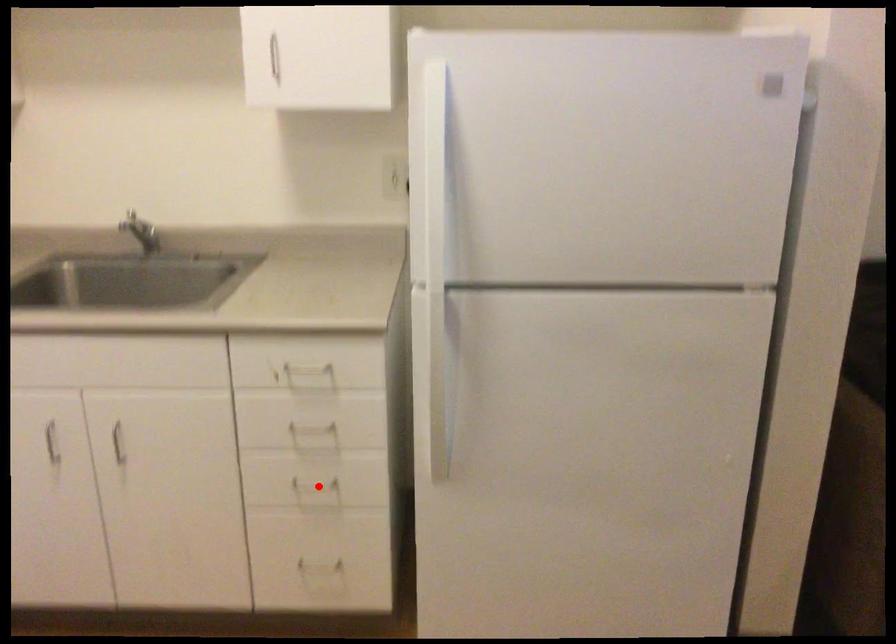
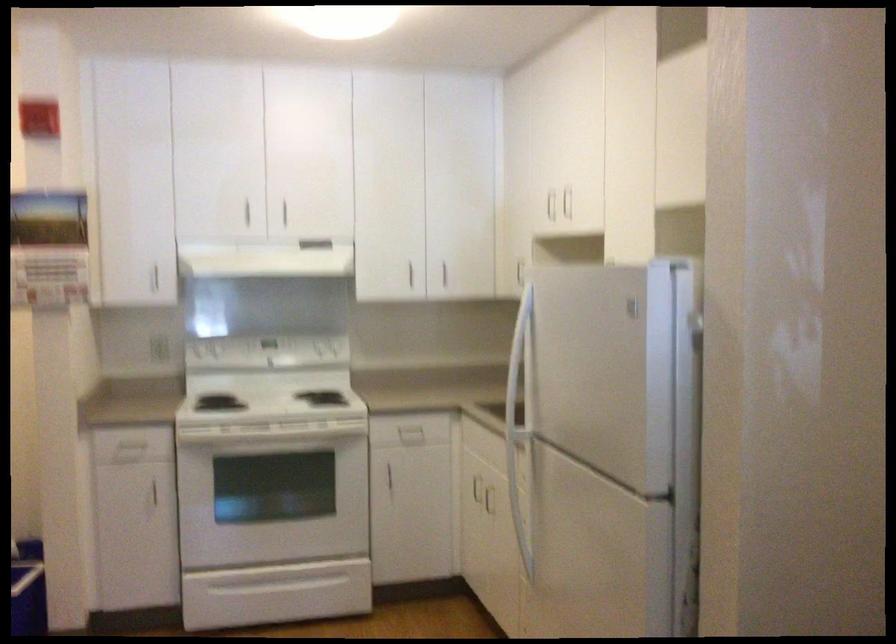
Question: I am providing you with two images of the same scene from different viewpoints. A red point is marked on the first image. At the location where the point appears in image 1, is it still visible in image 2?

Choices:
 (A) Yes
 (B) No

Answer: (B)